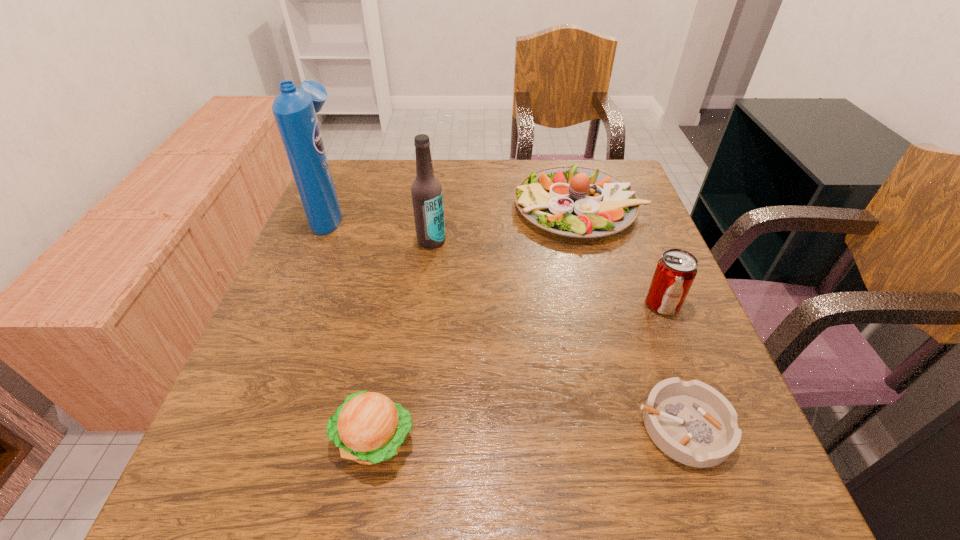
Find the location of a particular element. This screenshot has width=960, height=540. salad plate situated at the right edge is located at coordinates coord(573,201).

This screenshot has height=540, width=960. In order to click on ashtray located at the right edge in this screenshot , I will do `click(691, 422)`.

In order to click on object that is positioned at the far left corner in this screenshot , I will do `click(294, 109)`.

Identify the location of object present at the far right corner. Image resolution: width=960 pixels, height=540 pixels. (573, 201).

Identify the location of object positioned at the near right corner. (691, 422).

The height and width of the screenshot is (540, 960). What are the coordinates of `vacant region at the far edge` in the screenshot? It's located at (508, 185).

This screenshot has width=960, height=540. Find the location of `vacant space at the left edge of the desktop`. vacant space at the left edge of the desktop is located at coordinates (312, 368).

This screenshot has width=960, height=540. I want to click on vacant space at the right edge of the desktop, so click(x=700, y=374).

The height and width of the screenshot is (540, 960). What are the coordinates of `vacant space at the far left corner of the desktop` in the screenshot? It's located at (361, 178).

I want to click on free space at the near right corner of the desktop, so click(703, 512).